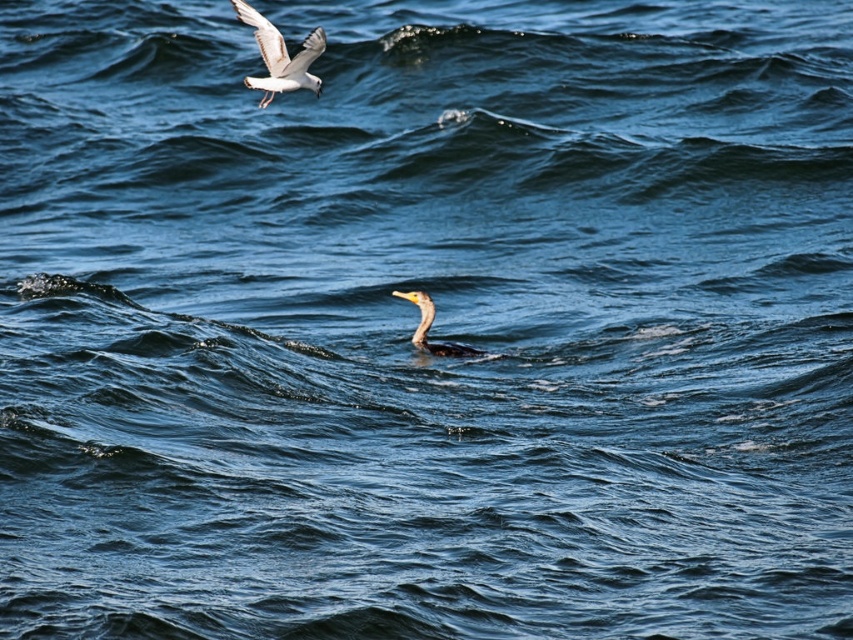
Question: Which point is closer to the camera?

Choices:
 (A) (309, 61)
 (B) (424, 348)

Answer: (A)

Question: Which of the following is the closest to the observer?

Choices:
 (A) shiny black duck at center
 (B) white feathered bird at upper left

Answer: (B)

Question: Is white feathered bird at upper left thinner than shiny black duck at center?

Choices:
 (A) no
 (B) yes

Answer: (B)

Question: Can you confirm if white feathered bird at upper left is positioned to the right of shiny black duck at center?

Choices:
 (A) yes
 (B) no

Answer: (B)

Question: Is white feathered bird at upper left further to camera compared to shiny black duck at center?

Choices:
 (A) yes
 (B) no

Answer: (B)